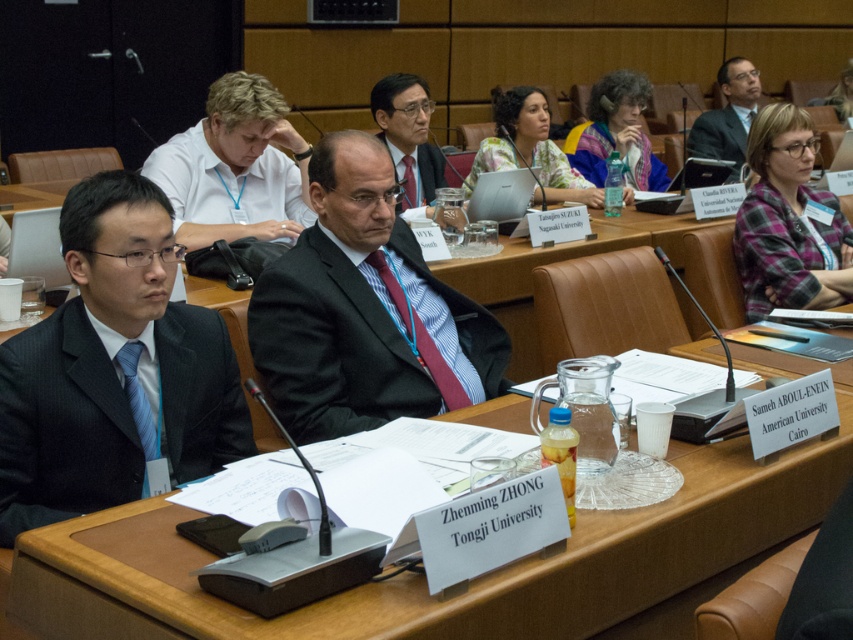
Question: Can you confirm if white smooth shirt at upper center is smaller than dark suit at upper right?

Choices:
 (A) no
 (B) yes

Answer: (B)

Question: Is black satin suit at center positioned at the back of maroon silk tie at center?

Choices:
 (A) no
 (B) yes

Answer: (A)

Question: Which object appears farthest from the camera in this image?

Choices:
 (A) white smooth shirt at upper center
 (B) plaid fabric shirt at right
 (C) maroon silk tie at center
 (D) matte red tie at center

Answer: (D)

Question: Which is farther from the multicolored fabric scarf at center?

Choices:
 (A) dark suit at upper right
 (B) black satin suit at center
 (C) white smooth shirt at upper center
 (D) matte red tie at center

Answer: (B)

Question: Estimate the real-world distances between objects in this image. Which object is closer to the black satin suit at center?

Choices:
 (A) matte pink blouse at center
 (B) multicolored fabric scarf at center
 (C) maroon silk tie at center

Answer: (C)

Question: From the image, what is the correct spatial relationship of black textured suit at left in relation to plaid fabric shirt at right?

Choices:
 (A) right
 (B) left

Answer: (B)